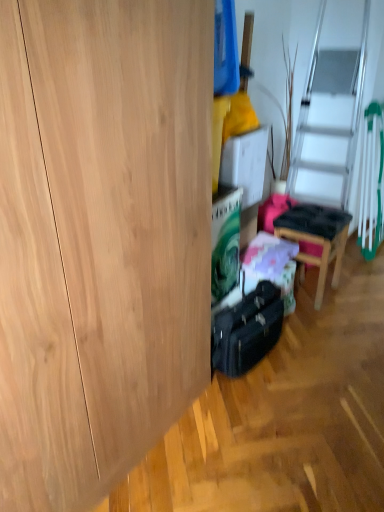
Question: Is the depth of black hardshell suitcase at center greater than that of wooden chair at center?

Choices:
 (A) yes
 (B) no

Answer: (B)

Question: Can you confirm if black hardshell suitcase at center is bigger than wooden chair at center?

Choices:
 (A) yes
 (B) no

Answer: (B)

Question: Does black hardshell suitcase at center have a lesser width compared to wooden chair at center?

Choices:
 (A) no
 (B) yes

Answer: (B)

Question: From a real-world perspective, is black hardshell suitcase at center physically below wooden chair at center?

Choices:
 (A) no
 (B) yes

Answer: (B)

Question: From the image's perspective, is black hardshell suitcase at center above wooden chair at center?

Choices:
 (A) yes
 (B) no

Answer: (B)

Question: From the image's perspective, would you say black hardshell suitcase at center is shown under wooden chair at center?

Choices:
 (A) no
 (B) yes

Answer: (B)

Question: Is black hardshell suitcase at center at the back of wooden chair at center?

Choices:
 (A) yes
 (B) no

Answer: (B)

Question: Could you tell me if wooden chair at center is turned towards black hardshell suitcase at center?

Choices:
 (A) yes
 (B) no

Answer: (B)

Question: From the image's perspective, is wooden chair at center located beneath black hardshell suitcase at center?

Choices:
 (A) no
 (B) yes

Answer: (A)

Question: Is wooden chair at center with black hardshell suitcase at center?

Choices:
 (A) no
 (B) yes

Answer: (A)

Question: Considering the relative sizes of wooden chair at center and black hardshell suitcase at center in the image provided, is wooden chair at center taller than black hardshell suitcase at center?

Choices:
 (A) no
 (B) yes

Answer: (B)

Question: Can you confirm if wooden chair at center is wider than black hardshell suitcase at center?

Choices:
 (A) yes
 (B) no

Answer: (A)

Question: From the image's perspective, is black hardshell suitcase at center above or below wooden chair at center?

Choices:
 (A) above
 (B) below

Answer: (B)